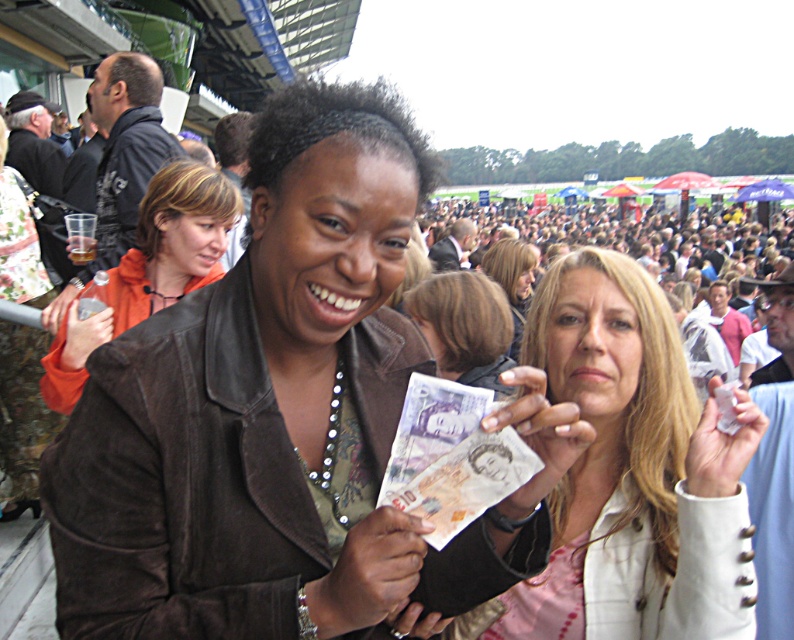
Question: Which point is closer to the camera?

Choices:
 (A) (613, 355)
 (B) (518, 244)
 (C) (442, 509)
 (D) (130, 284)

Answer: (C)

Question: Which object is the closest to the smooth brown hair at center?

Choices:
 (A) brown leather jacket at center
 (B) blonde hair at center

Answer: (B)

Question: Where is white textured jacket at center located in relation to purple paper currency at center in the image?

Choices:
 (A) above
 (B) below

Answer: (A)

Question: Which point appears farthest from the camera in this image?

Choices:
 (A) (704, 467)
 (B) (424, 378)
 (C) (448, 314)

Answer: (C)

Question: Can you confirm if white textured jacket at center is positioned below purple paper currency at center?

Choices:
 (A) no
 (B) yes

Answer: (A)

Question: Observing the image, what is the correct spatial positioning of white textured jacket at center in reference to orange leather jacket at upper left?

Choices:
 (A) right
 (B) left

Answer: (A)